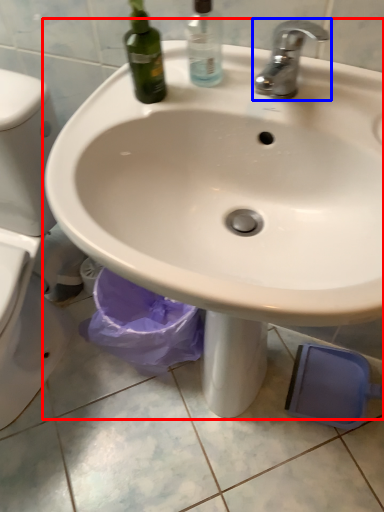
Question: Among these objects, which one is farthest to the camera, sink (highlighted by a red box) or tap (highlighted by a blue box)?

Choices:
 (A) sink
 (B) tap

Answer: (B)